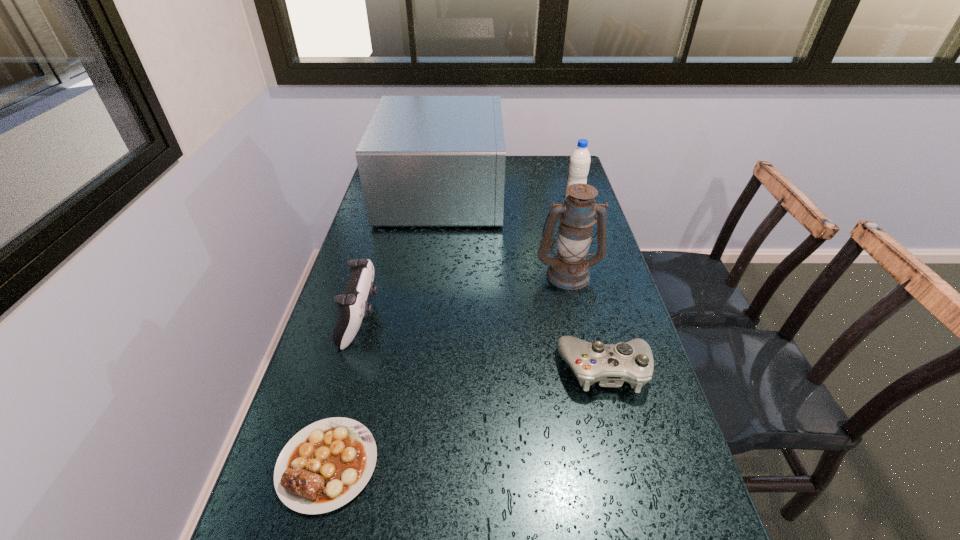
You are a GUI agent. You are given a task and a screenshot of the screen. Output one action in this format:
    pyautogui.click(x=<x>, y=<y>)
    Task: Click on the free space between the shortest object and the shorter control
    This screenshot has height=540, width=960.
    Given the screenshot: What is the action you would take?
    pyautogui.click(x=467, y=417)

Image resolution: width=960 pixels, height=540 pixels. I want to click on empty space that is in between the fourth tallest object and the second shortest object, so click(x=483, y=345).

This screenshot has height=540, width=960. In order to click on free spot between the oil lamp and the microwave oven in this screenshot , I will do `click(505, 233)`.

You are a GUI agent. You are given a task and a screenshot of the screen. Output one action in this format:
    pyautogui.click(x=<x>, y=<y>)
    Task: Click on the free space between the shortest object and the oil lamp
    The height and width of the screenshot is (540, 960).
    Given the screenshot: What is the action you would take?
    click(447, 369)

Image resolution: width=960 pixels, height=540 pixels. I want to click on unoccupied area between the microwave oven and the water bottle, so click(x=508, y=197).

Find the location of a particular element. This screenshot has width=960, height=540. vacant space in between the second shortest object and the microwave oven is located at coordinates (524, 281).

Find the location of `the third closest object relative to the oil lamp`. the third closest object relative to the oil lamp is located at coordinates (579, 164).

I want to click on the second closest object to the oil lamp, so click(610, 365).

Where is `vacant space that satisfies the following two spatial constraints: 1. on the back side of the nearest object; 2. on the left side of the water bottle`? The height and width of the screenshot is (540, 960). vacant space that satisfies the following two spatial constraints: 1. on the back side of the nearest object; 2. on the left side of the water bottle is located at coordinates (397, 202).

Find the location of a particular element. This screenshot has height=540, width=960. free spot that satisfies the following two spatial constraints: 1. with the door open on the water bottle; 2. on the left side of the microwave oven is located at coordinates (442, 202).